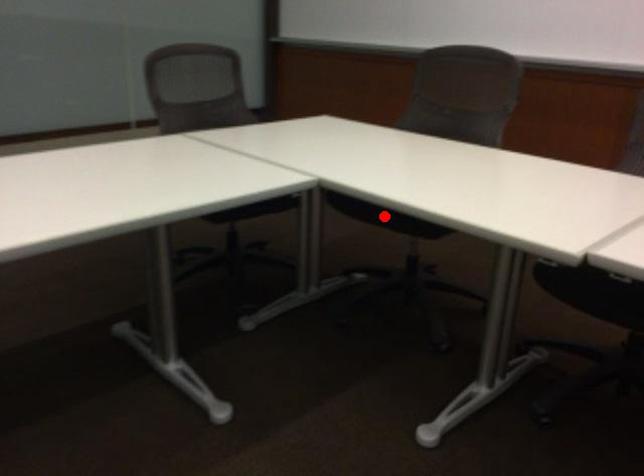
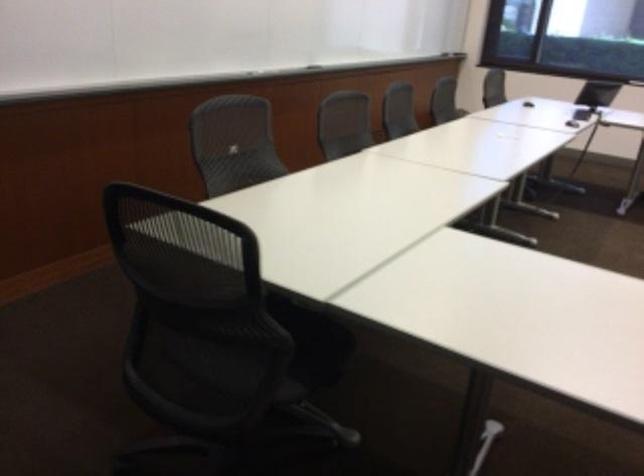
Question: I am providing you with two images of the same scene from different viewpoints. A red point is marked on the first image. Is the red point's position out of view in image 2?

Choices:
 (A) Yes
 (B) No

Answer: (A)